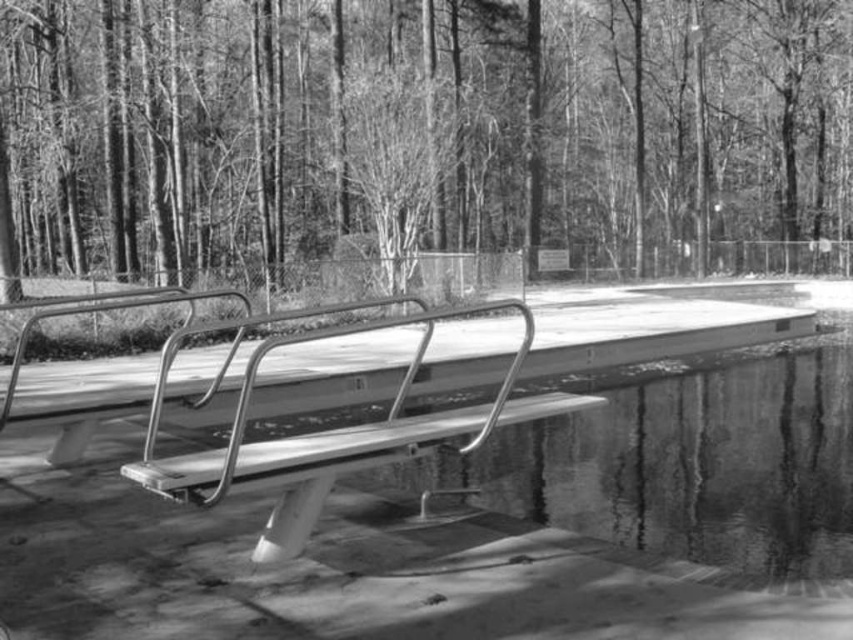
You are standing in the park and want to sit on the metallic silver bench at center. However, there is a smooth bark tree at center in your way. Can you walk straight towards the bench without going around the tree?

The smooth bark tree at center is further to the viewer than the metallic silver bench at center, so the bench is closer to you. Therefore, you can walk straight towards the bench without needing to go around the tree because the tree is behind the bench.

You are a photographer standing at the camera position in the scene. You want to take a closeup shot of the smooth bark tree at center. What should you do to get a closer view?

The smooth bark tree at center is 13.00 meters away from the camera. To get a closer view, you should move closer to the smooth bark tree at center or use a zoom lens to magnify the image.

In the scene shown: You are planning to place a large sculpture between the smooth bark tree at center and the metallic silver bench at center. Which object should the sculpture be placed closer to so it doesn

The sculpture should be placed closer to the smooth bark tree at center because it is larger than the metallic silver bench at center, making it a better focal point for the sculpture.